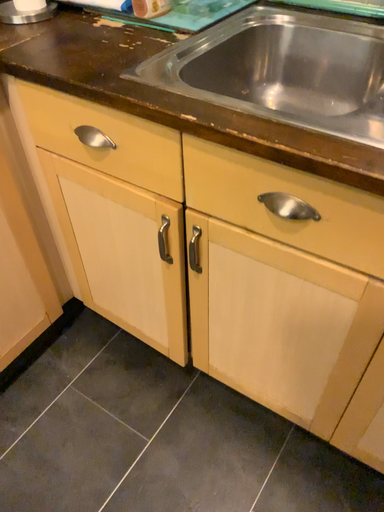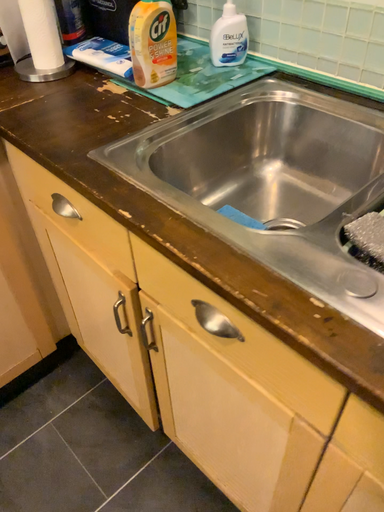
Question: Which way did the camera rotate in the video?

Choices:
 (A) rotated left
 (B) rotated right

Answer: (A)